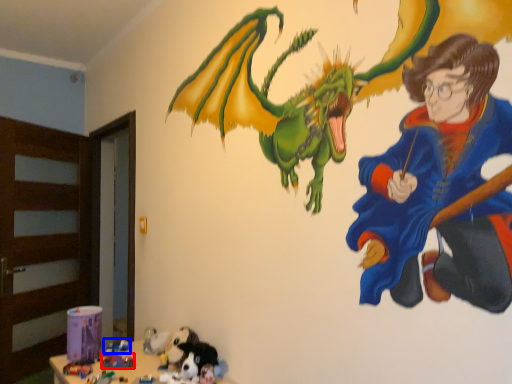
Question: Which point is further to the camera, toy (highlighted by a red box) or toy (highlighted by a blue box)?

Choices:
 (A) toy
 (B) toy

Answer: (B)